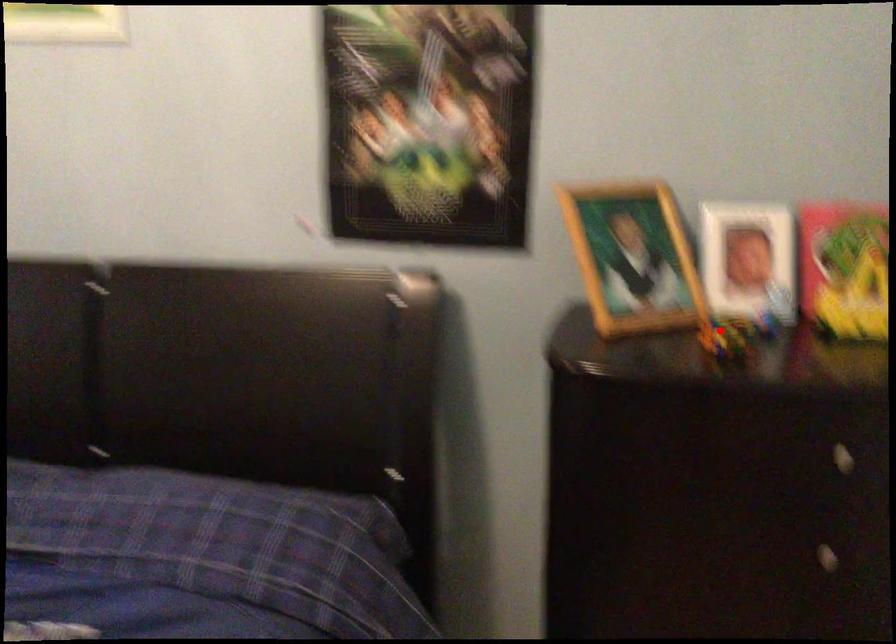
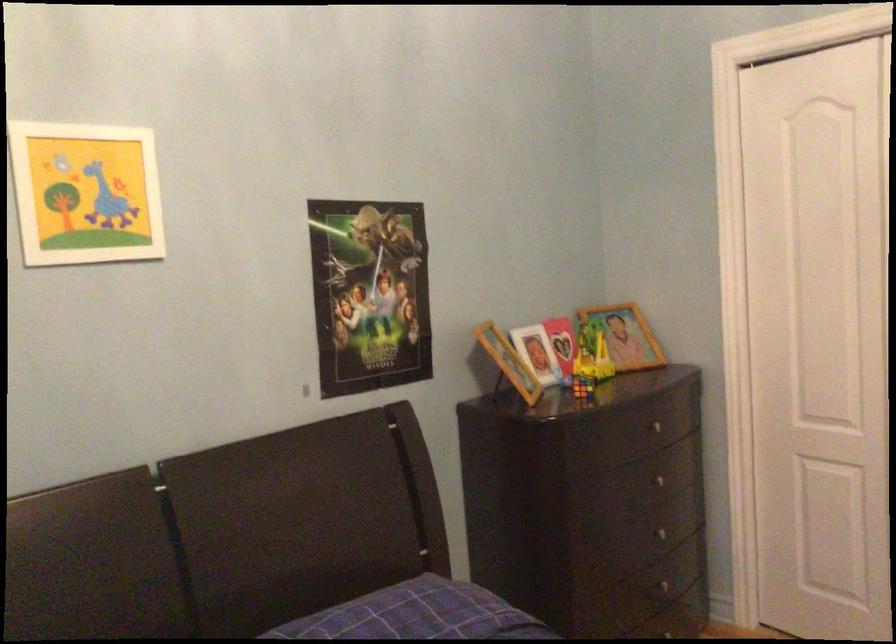
Find the pixel in the second image that matches the highlighted location in the first image.

(582, 386)